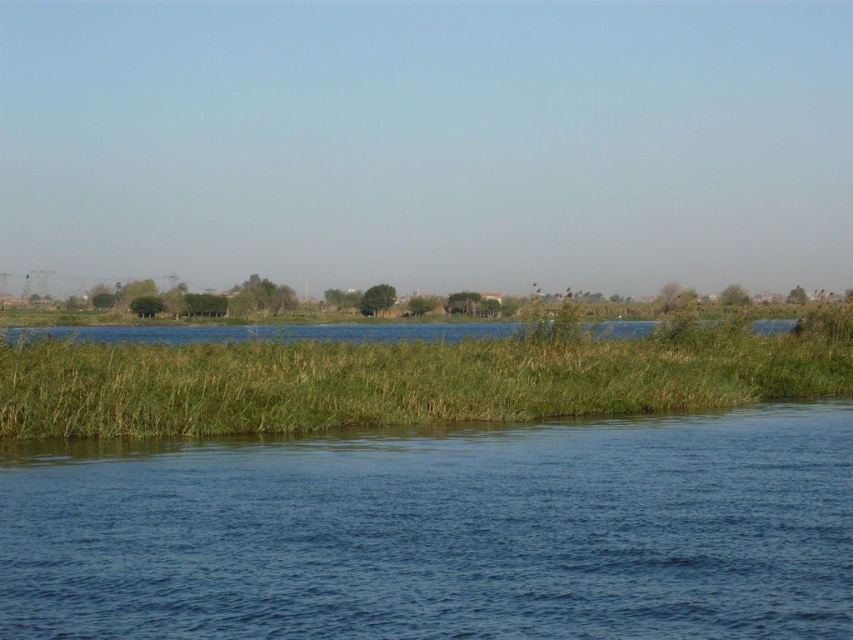
Who is higher up, blue liquid water at center or green grassy at lower center?

Positioned higher is green grassy at lower center.

Is point (45, 584) closer to camera compared to point (57, 362)?

That is True.

The width and height of the screenshot is (853, 640). Find the location of `blue liquid water at center`. blue liquid water at center is located at coordinates (444, 532).

Which of these two, green grassy at lower center or green grassy river at center, stands shorter?

green grassy river at center

The image size is (853, 640). Describe the element at coordinates (399, 380) in the screenshot. I see `green grassy at lower center` at that location.

This screenshot has width=853, height=640. Identify the location of green grassy at lower center. (399, 380).

Is the position of blue liquid water at center more distant than that of green grassy river at center?

No, it is in front of green grassy river at center.

Can you confirm if blue liquid water at center is shorter than green grassy river at center?

Correct, blue liquid water at center is not as tall as green grassy river at center.

Locate an element on the screen. blue liquid water at center is located at coordinates (444, 532).

Locate an element on the screen. blue liquid water at center is located at coordinates [444, 532].